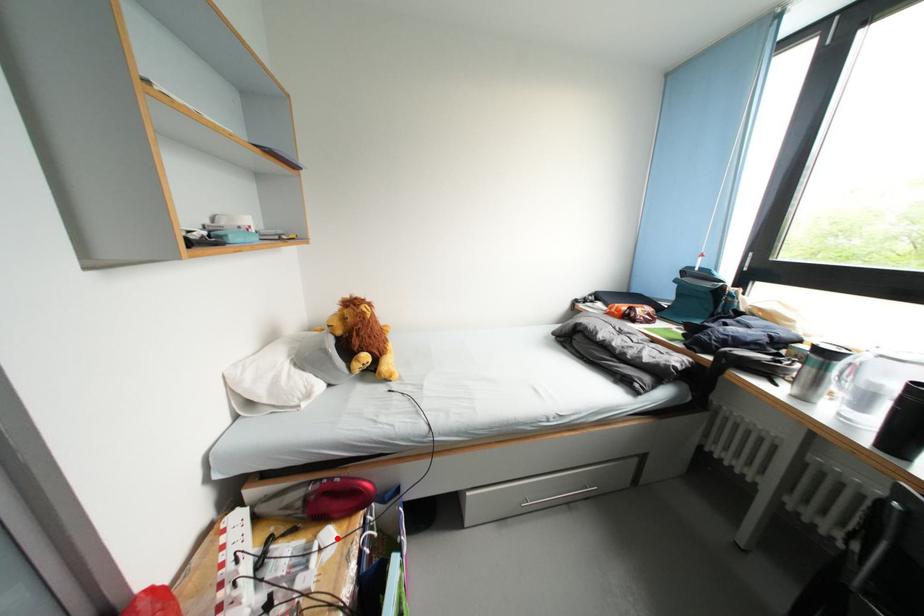
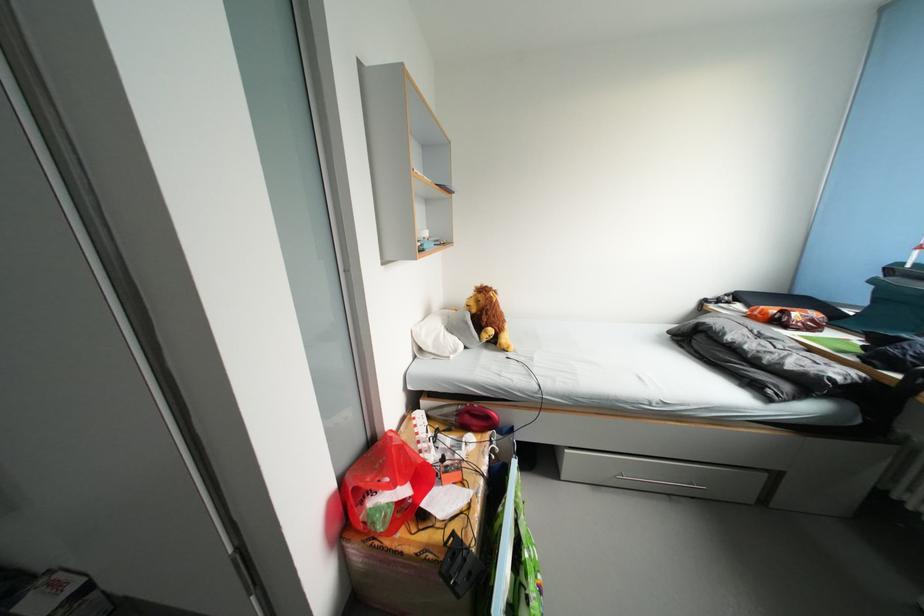
Question: I am providing you with two images of the same scene from different viewpoints. A red point is shown in image1. For the corresponding object point in image2, is it positioned nearer or farther from the camera?

Choices:
 (A) Nearer
 (B) Farther

Answer: (B)